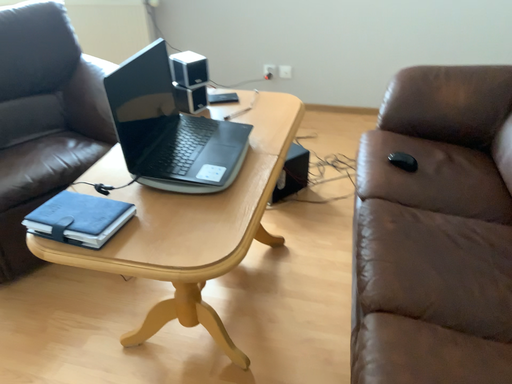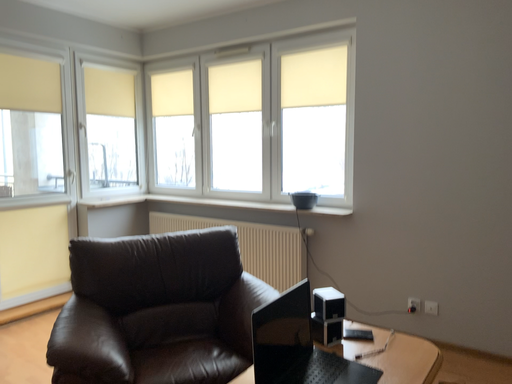
Question: Which way did the camera rotate in the video?

Choices:
 (A) rotated right
 (B) rotated left

Answer: (B)